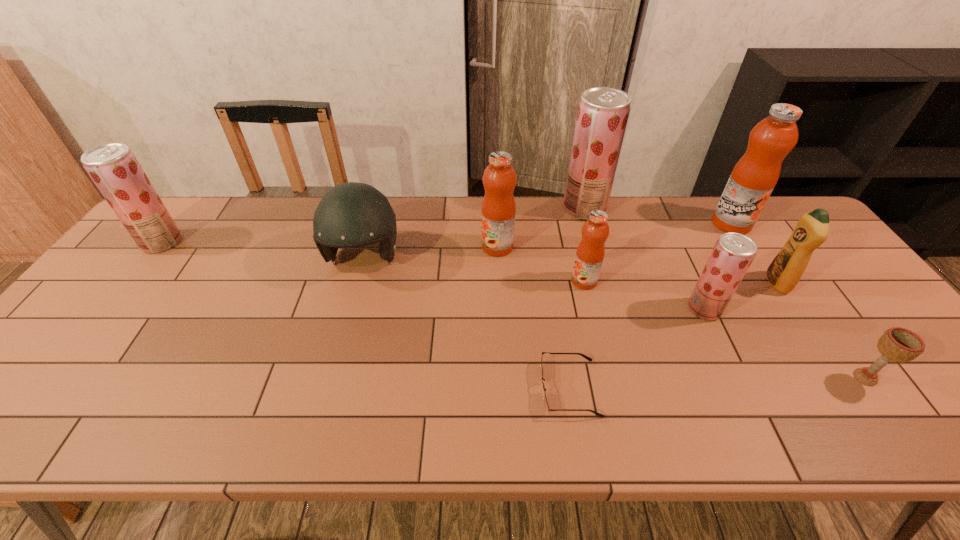
I want to click on football helmet, so click(352, 214).

Where is `the seventh object from left to right`? This screenshot has width=960, height=540. the seventh object from left to right is located at coordinates (733, 253).

I want to click on the second fruit juice from right to left, so click(x=733, y=253).

What are the coordinates of `the fifth farthest fruit juice` in the screenshot? It's located at (590, 253).

This screenshot has width=960, height=540. In order to click on the smallest orange fruit juice in this screenshot , I will do `click(590, 253)`.

Locate an element on the screen. The width and height of the screenshot is (960, 540). chalice is located at coordinates (897, 344).

This screenshot has width=960, height=540. In order to click on the second shortest object in this screenshot , I will do `click(897, 344)`.

Identify the location of the shortest object. This screenshot has width=960, height=540. (546, 405).

Find the location of a particular element. The height and width of the screenshot is (540, 960). black spectacles is located at coordinates (546, 405).

I want to click on vacant space positioned on the left of the farthest strawberry fruit juice, so click(459, 208).